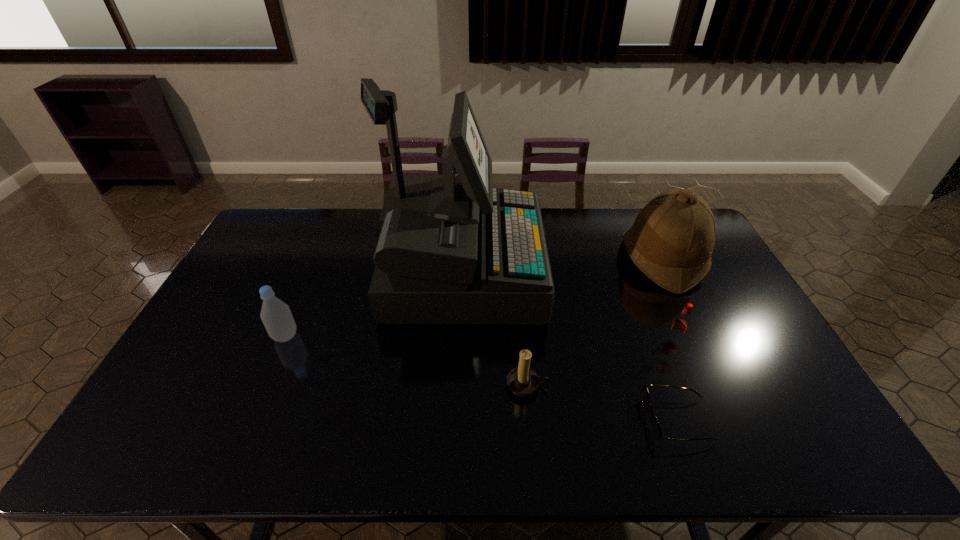
This screenshot has height=540, width=960. I want to click on vacant space located on the front-facing side of the hat, so click(587, 259).

Identify the location of vacant space located on the right of the leftmost object. (434, 336).

Image resolution: width=960 pixels, height=540 pixels. What are the coordinates of `blank area located 0.150m on the right of the root beer` in the screenshot? It's located at (733, 340).

Locate an element on the screen. vacant region located on the wick of the candle holder is located at coordinates (532, 437).

The image size is (960, 540). I want to click on vacant area situated 0.140m on the face of the spectacles, so click(x=590, y=420).

The height and width of the screenshot is (540, 960). I want to click on blank space located on the face of the spectacles, so click(x=582, y=420).

The height and width of the screenshot is (540, 960). I want to click on free point located on the face of the spectacles, so [x=492, y=420].

Locate an element on the screen. The width and height of the screenshot is (960, 540). cash register at the far edge is located at coordinates (452, 250).

The width and height of the screenshot is (960, 540). I want to click on hat that is positioned at the far edge, so click(x=671, y=241).

Locate an element on the screen. Image resolution: width=960 pixels, height=540 pixels. object located at the near edge is located at coordinates (655, 427).